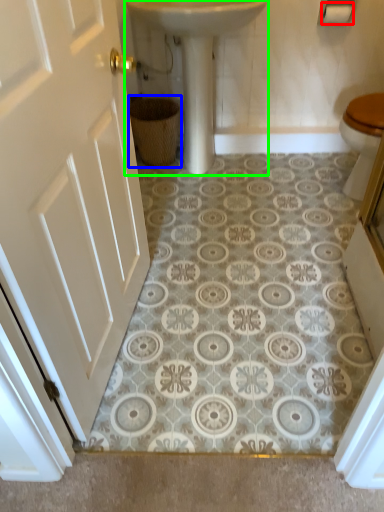
Question: Which object is the closest to the toilet paper (highlighted by a red box)? Choose among these: basket (highlighted by a blue box) or sink (highlighted by a green box).

Choices:
 (A) basket
 (B) sink

Answer: (B)